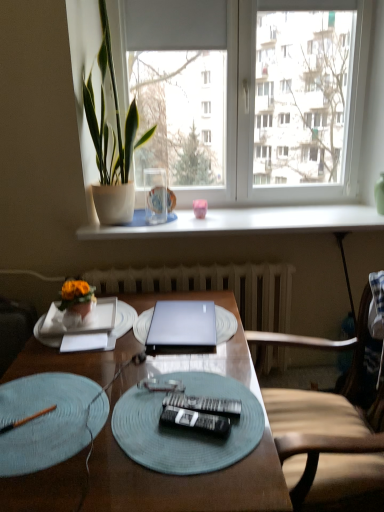
Find the location of a particular element. The height and width of the screenshot is (512, 384). free space to the right of green leafy plant at left is located at coordinates (199, 220).